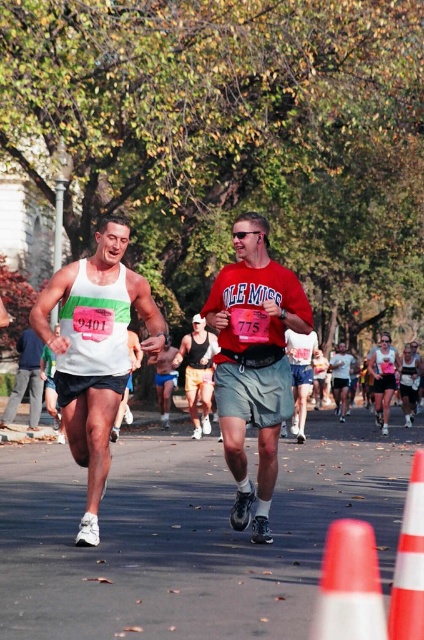
Question: Can you confirm if orange plastic traffic cone at lower right is smaller than matte red shirt at center?

Choices:
 (A) yes
 (B) no

Answer: (A)

Question: Is orange plastic traffic cone at lower right thinner than white cotton tank top at center?

Choices:
 (A) yes
 (B) no

Answer: (A)

Question: Which object is closer to the camera taking this photo?

Choices:
 (A) red matte shirt at center
 (B) white tank top at center
 (C) white matte tank top at left
 (D) matte blue shorts at center

Answer: (C)

Question: Which point is closer to the camera taking this photo?

Choices:
 (A) (75, 348)
 (B) (331, 524)

Answer: (A)

Question: Which of the following is the farthest from the observer?

Choices:
 (A) matte red shirt at center
 (B) white plastic traffic cone at lower right
 (C) matte blue shorts at center

Answer: (C)

Question: Where is orange plastic traffic cone at lower right located in relation to matte blue shorts at center in the image?

Choices:
 (A) left
 (B) right

Answer: (B)